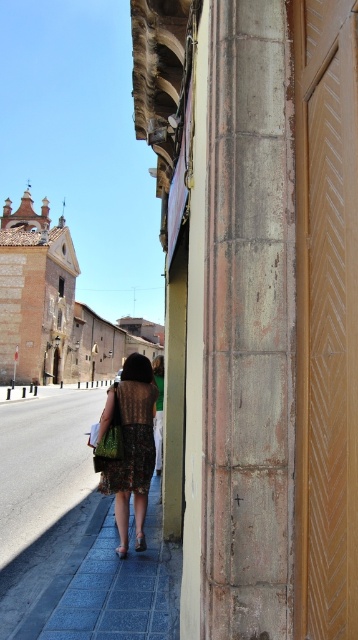
Question: Observing the image, what is the correct spatial positioning of gray stone column at center in reference to knitted brown dress at center?

Choices:
 (A) left
 (B) right

Answer: (B)

Question: Is gray stone column at center above knitted brown dress at center?

Choices:
 (A) yes
 (B) no

Answer: (A)

Question: Which of the following is the closest to the observer?

Choices:
 (A) gray stone column at center
 (B) knitted brown dress at center

Answer: (A)

Question: Which point appears closest to the camera in this image?

Choices:
 (A) (128, 452)
 (B) (243, 582)

Answer: (B)

Question: Can you confirm if gray stone column at center is positioned to the right of knitted brown dress at center?

Choices:
 (A) yes
 (B) no

Answer: (A)